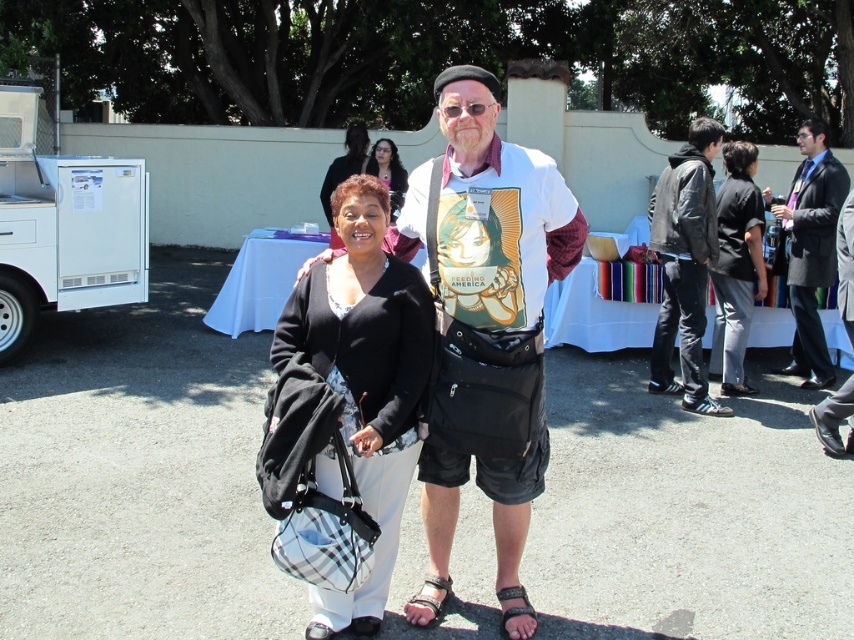
You are a photographer trying to capture a closeup of the matte black shirt at center and the leather sandal at lower center. Which object should you zoom in on to ensure both are in focus without moving the camera?

The matte black shirt at center is wider than the leather sandal at lower center, so you should zoom in on the leather sandal at lower center to ensure both are in focus without moving the camera.